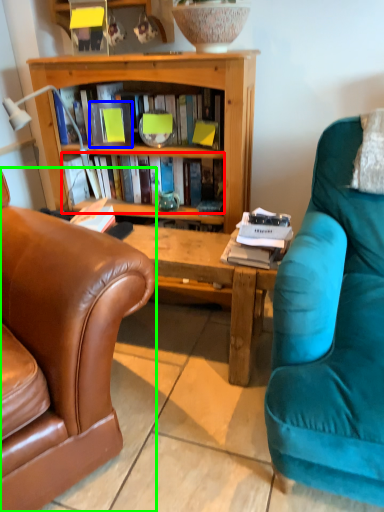
Question: Which object is the closest to the book (highlighted by a red box)? Choose among these: paperback book (highlighted by a blue box) or chair (highlighted by a green box).

Choices:
 (A) paperback book
 (B) chair

Answer: (A)